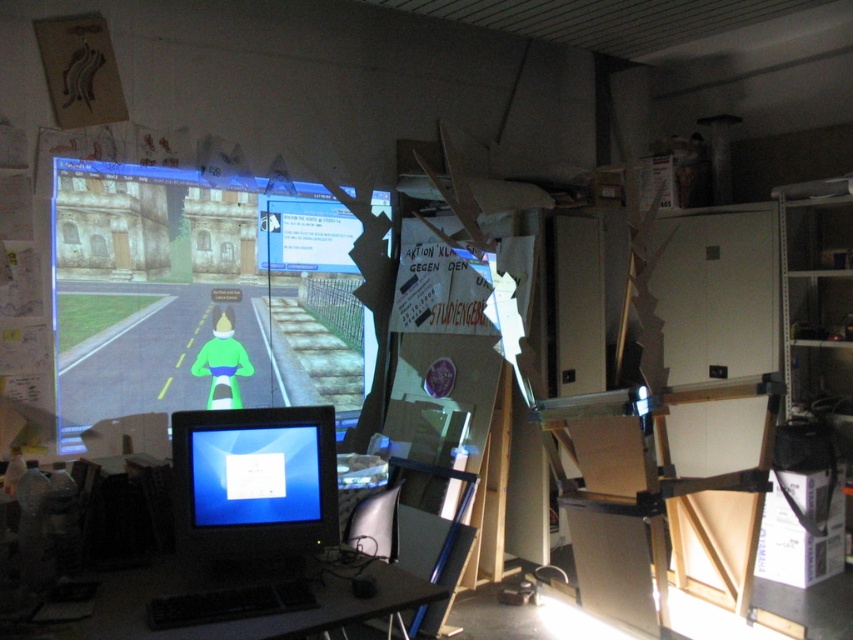
Does point (189, 435) lie in front of point (103, 582)?

No, (189, 435) is behind (103, 582).

Who is positioned more to the left, matte black monitor at lower left or black plastic computer desk at lower center?

Positioned to the left is matte black monitor at lower left.

Who is more distant from viewer, [180,461] or [329,608]?

Point [180,461]

Locate an element on the screen. matte black monitor at lower left is located at coordinates (x=254, y=481).